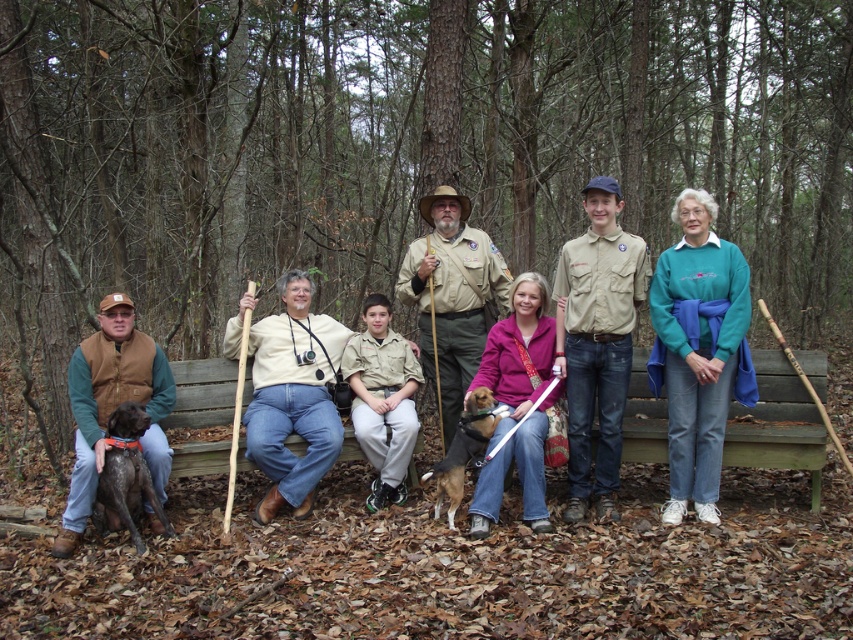
Question: Among these points, which one is nearest to the camera?

Choices:
 (A) (294, 419)
 (B) (410, 396)

Answer: (A)

Question: Is khaki uniform at center to the right of purple fleece jacket at center from the viewer's perspective?

Choices:
 (A) no
 (B) yes

Answer: (A)

Question: Does khaki uniform shirt at center come behind brown suede vest at left?

Choices:
 (A) no
 (B) yes

Answer: (B)

Question: Which point is farther from the camera taking this photo?

Choices:
 (A) (447, 209)
 (B) (315, 476)
 (C) (132, 477)

Answer: (A)

Question: Is purple fleece jacket at center smaller than tan uniform at center?

Choices:
 (A) yes
 (B) no

Answer: (B)

Question: Which point is farther to the camera?

Choices:
 (A) brown furry dog at center
 (B) tan uniform at center

Answer: (B)